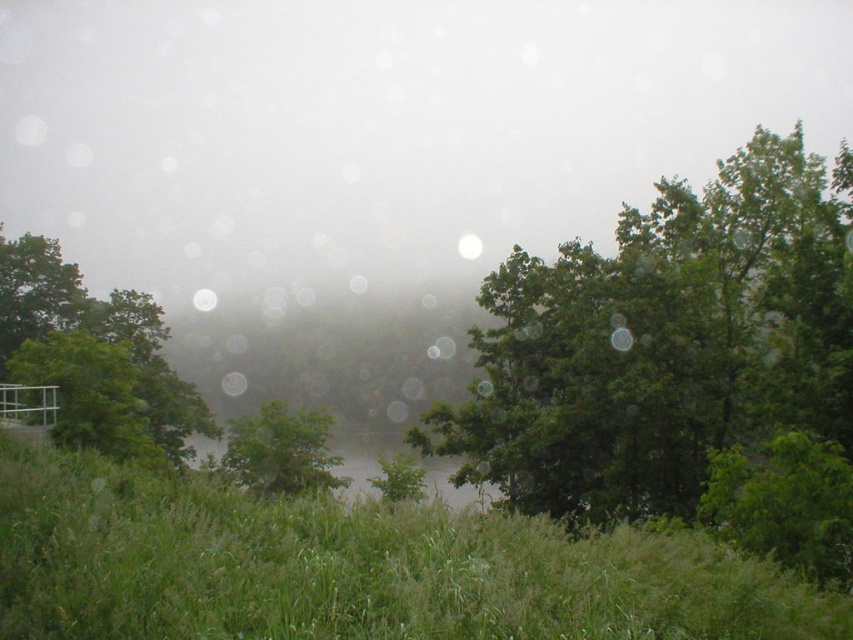
Who is more forward, (x=131, y=410) or (x=486, y=504)?

Point (x=486, y=504) is more forward.

Based on the photo, who is more distant from viewer, (35, 266) or (465, 492)?

The point (35, 266) is behind.

Image resolution: width=853 pixels, height=640 pixels. I want to click on green leafy tree at left, so click(x=97, y=336).

Can you confirm if green leafy tree at upper right is taller than green leafy tree at left?

No, green leafy tree at upper right is not taller than green leafy tree at left.

At what (x,y) coordinates should I click in order to perform the action: click on green leafy tree at upper right. Please return your answer as a coordinate pair (x, y). Looking at the image, I should click on (676, 360).

Does green leafy tree at left lie in front of green leafy tree at center?

Yes.

Image resolution: width=853 pixels, height=640 pixels. What do you see at coordinates (97, 336) in the screenshot?
I see `green leafy tree at left` at bounding box center [97, 336].

I want to click on green leafy tree at left, so click(x=97, y=336).